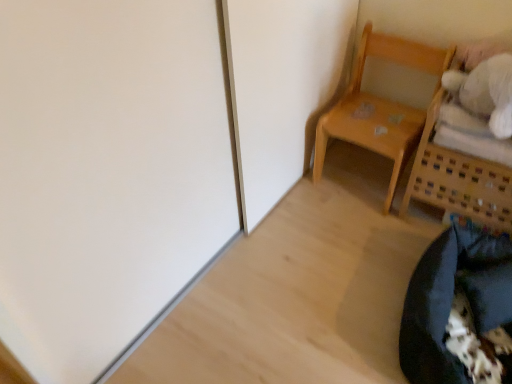
Question: From a real-world perspective, is light wood chair at upper right, the first furniture when ordered from left to right, positioned over wooden basket at upper right, the 2th furniture positioned from the left, based on gravity?

Choices:
 (A) no
 (B) yes

Answer: (B)

Question: Is light wood chair at upper right, which is the second furniture in right-to-left order, not inside wooden basket at upper right, the 2th furniture positioned from the left?

Choices:
 (A) yes
 (B) no

Answer: (A)

Question: Is light wood chair at upper right, which is the second furniture in right-to-left order, in contact with wooden basket at upper right, the 2th furniture positioned from the left?

Choices:
 (A) no
 (B) yes

Answer: (A)

Question: Considering the relative sizes of light wood chair at upper right, which is the second furniture in right-to-left order, and wooden basket at upper right, which is counted as the 1th furniture, starting from the right, in the image provided, is light wood chair at upper right, which is the second furniture in right-to-left order, taller than wooden basket at upper right, which is counted as the 1th furniture, starting from the right,?

Choices:
 (A) no
 (B) yes

Answer: (B)

Question: From a real-world perspective, is light wood chair at upper right, the first furniture when ordered from left to right, positioned under wooden basket at upper right, the 2th furniture positioned from the left, based on gravity?

Choices:
 (A) yes
 (B) no

Answer: (B)

Question: Is light wood chair at upper right, which is the second furniture in right-to-left order, to the left or to the right of black fabric bean bag chair at lower right in the image?

Choices:
 (A) left
 (B) right

Answer: (A)

Question: Considering the positions of light wood chair at upper right, the first furniture when ordered from left to right, and black fabric bean bag chair at lower right in the image, is light wood chair at upper right, the first furniture when ordered from left to right, bigger or smaller than black fabric bean bag chair at lower right?

Choices:
 (A) small
 (B) big

Answer: (B)

Question: Is light wood chair at upper right, which is the second furniture in right-to-left order, wider or thinner than black fabric bean bag chair at lower right?

Choices:
 (A) thin
 (B) wide

Answer: (A)

Question: Relative to black fabric bean bag chair at lower right, is light wood chair at upper right, the first furniture when ordered from left to right, in front or behind?

Choices:
 (A) front
 (B) behind

Answer: (B)

Question: In terms of size, does light wood chair at upper right, the first furniture when ordered from left to right, appear bigger or smaller than wooden basket at upper right, the 2th furniture positioned from the left?

Choices:
 (A) small
 (B) big

Answer: (A)

Question: From the image's perspective, is light wood chair at upper right, the first furniture when ordered from left to right, located above or below wooden basket at upper right, which is counted as the 1th furniture, starting from the right?

Choices:
 (A) above
 (B) below

Answer: (A)

Question: From a real-world perspective, is light wood chair at upper right, which is the second furniture in right-to-left order, above or below wooden basket at upper right, which is counted as the 1th furniture, starting from the right?

Choices:
 (A) below
 (B) above

Answer: (B)

Question: Is light wood chair at upper right, which is the second furniture in right-to-left order, to the left or to the right of wooden basket at upper right, the 2th furniture positioned from the left, in the image?

Choices:
 (A) right
 (B) left

Answer: (B)

Question: From a real-world perspective, is wooden basket at upper right, the 2th furniture positioned from the left, physically located above or below black fabric bean bag chair at lower right?

Choices:
 (A) below
 (B) above

Answer: (B)

Question: Is wooden basket at upper right, the 2th furniture positioned from the left, to the left or to the right of black fabric bean bag chair at lower right in the image?

Choices:
 (A) left
 (B) right

Answer: (B)